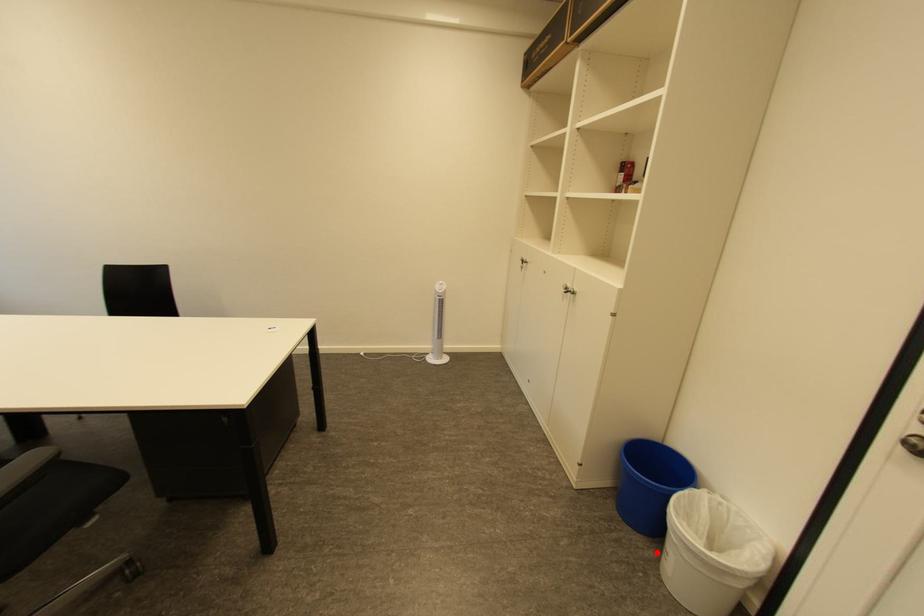
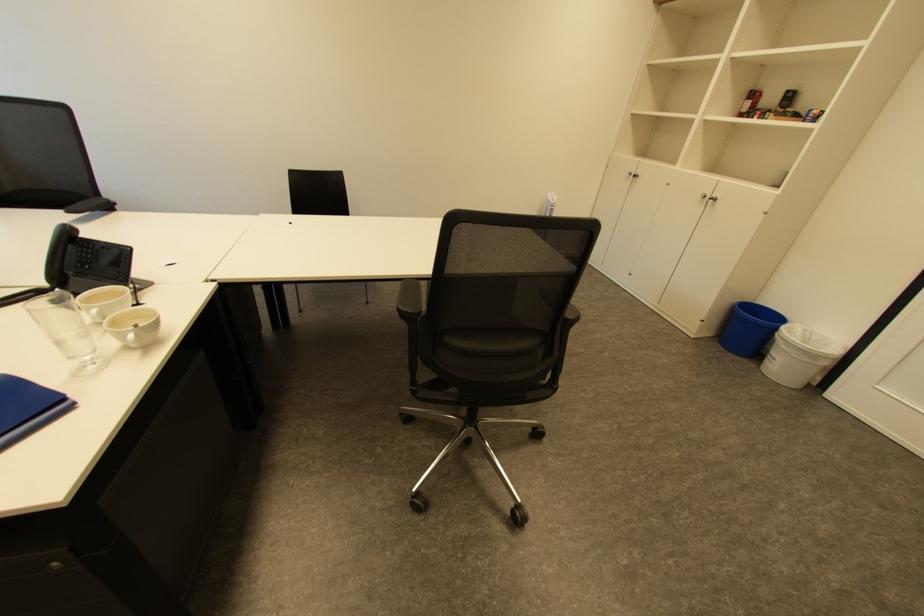
Locate, in the second image, the point that corresponds to the highlighted location in the first image.

(760, 365)